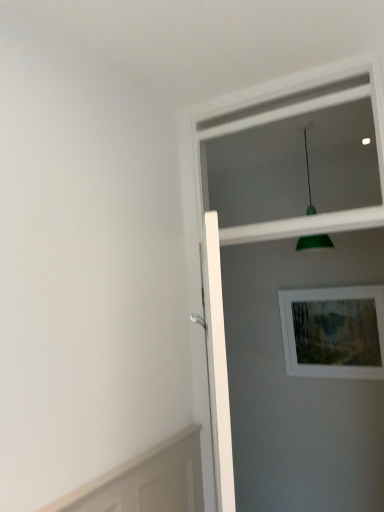
Question: Considering the relative sizes of wooden picture frame at upper right and green matte pendant light at upper center in the image provided, is wooden picture frame at upper right shorter than green matte pendant light at upper center?

Choices:
 (A) no
 (B) yes

Answer: (B)

Question: Could you tell me if wooden picture frame at upper right is turned towards green matte pendant light at upper center?

Choices:
 (A) no
 (B) yes

Answer: (A)

Question: Considering the relative sizes of wooden picture frame at upper right and green matte pendant light at upper center in the image provided, is wooden picture frame at upper right bigger than green matte pendant light at upper center?

Choices:
 (A) no
 (B) yes

Answer: (A)

Question: From the image's perspective, does wooden picture frame at upper right appear lower than green matte pendant light at upper center?

Choices:
 (A) yes
 (B) no

Answer: (A)

Question: Is wooden picture frame at upper right thinner than green matte pendant light at upper center?

Choices:
 (A) no
 (B) yes

Answer: (B)

Question: From the image's perspective, is white plastic window frame at upper center located above or below green matte pendant light at upper center?

Choices:
 (A) above
 (B) below

Answer: (A)

Question: Based on their sizes in the image, would you say white plastic window frame at upper center is bigger or smaller than green matte pendant light at upper center?

Choices:
 (A) small
 (B) big

Answer: (B)

Question: From their relative heights in the image, would you say white plastic window frame at upper center is taller or shorter than green matte pendant light at upper center?

Choices:
 (A) tall
 (B) short

Answer: (B)

Question: From a real-world perspective, is white plastic window frame at upper center physically located above or below green matte pendant light at upper center?

Choices:
 (A) above
 (B) below

Answer: (A)

Question: From a real-world perspective, relative to green matte pendant light at upper center, is wooden picture frame at upper right vertically above or below?

Choices:
 (A) above
 (B) below

Answer: (B)

Question: Is point (352, 313) positioned closer to the camera than point (299, 241)?

Choices:
 (A) closer
 (B) farther

Answer: (A)

Question: In the image, is wooden picture frame at upper right on the left side or the right side of green matte pendant light at upper center?

Choices:
 (A) left
 (B) right

Answer: (B)

Question: In the image, is wooden picture frame at upper right positioned in front of or behind green matte pendant light at upper center?

Choices:
 (A) front
 (B) behind

Answer: (B)

Question: In terms of width, does green matte pendant light at upper center look wider or thinner when compared to white plastic window frame at upper center?

Choices:
 (A) wide
 (B) thin

Answer: (A)

Question: Is green matte pendant light at upper center taller or shorter than white plastic window frame at upper center?

Choices:
 (A) tall
 (B) short

Answer: (A)